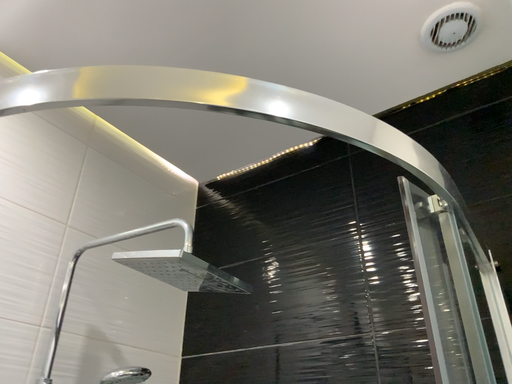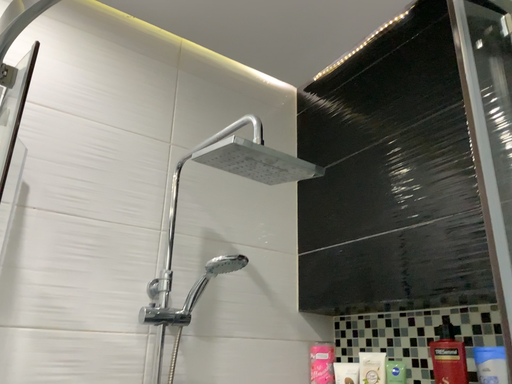
Question: Which way did the camera rotate in the video?

Choices:
 (A) rotated upward
 (B) rotated downward

Answer: (B)